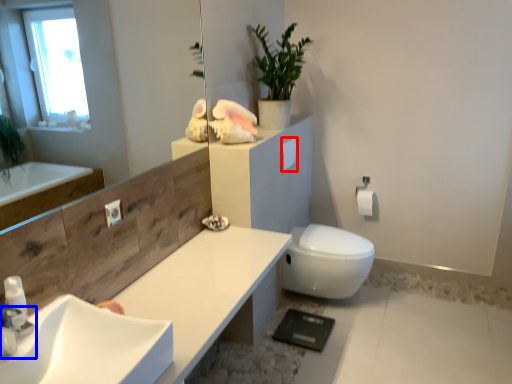
Question: Among these objects, which one is nearest to the camera, toilet paper (highlighted by a red box) or tap (highlighted by a blue box)?

Choices:
 (A) toilet paper
 (B) tap

Answer: (B)